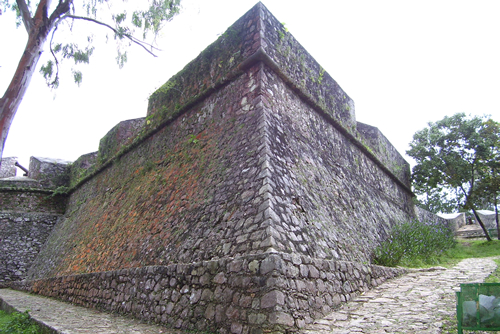
Where is `wall`? This screenshot has height=334, width=500. wall is located at coordinates (200, 200), (296, 166), (17, 242).